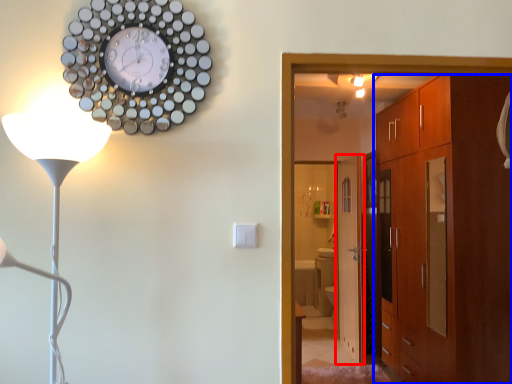
Question: Which point is further to the camera, door (highlighted by a red box) or cabinetry (highlighted by a blue box)?

Choices:
 (A) door
 (B) cabinetry

Answer: (A)